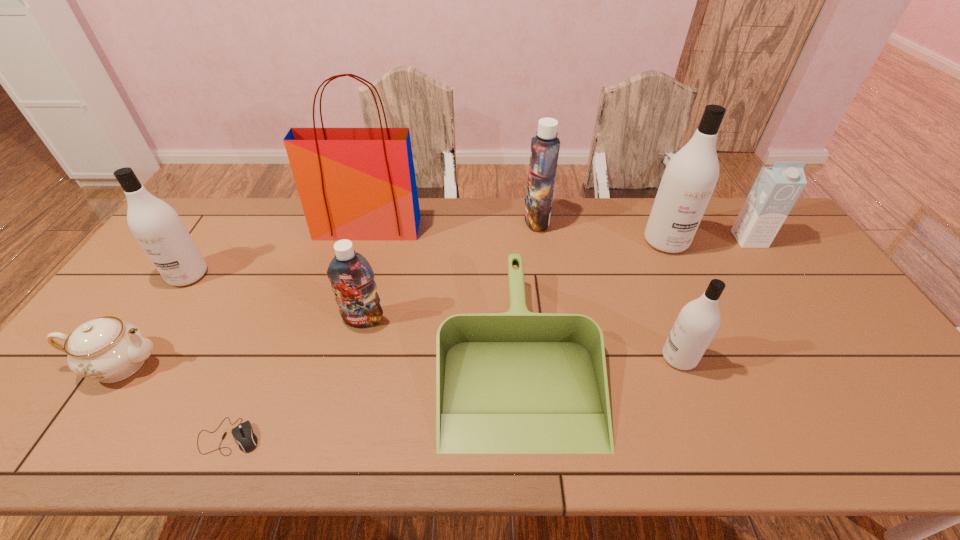
I want to click on the smaller blue shampoo, so click(x=352, y=279).

Identify the location of the fourth shampoo from right to left. The image size is (960, 540). (352, 279).

You are a GUI agent. You are given a task and a screenshot of the screen. Output one action in this format:
    pyautogui.click(x=<x>, y=<y>)
    Task: Click on the eighth tallest object
    This screenshot has height=540, width=960.
    Given the screenshot: What is the action you would take?
    pyautogui.click(x=107, y=349)

The image size is (960, 540). In order to click on dustpan in this screenshot , I will do `click(518, 382)`.

Image resolution: width=960 pixels, height=540 pixels. Find the location of `the shortest object`. the shortest object is located at coordinates (243, 433).

At what (x,y) coordinates should I click in order to perform the action: click on free space located on the handle side of the shopping bag. Please return your answer as a coordinate pair (x, y). The width and height of the screenshot is (960, 540). Looking at the image, I should click on (357, 267).

Locate an element on the screen. free space located 0.370m on the front-facing side of the tallest shampoo is located at coordinates (717, 353).

At what (x,y) coordinates should I click in order to perform the action: click on vacant space situated on the front label of the bigger blue shampoo. Please return your answer as a coordinate pair (x, y). The image size is (960, 540). Looking at the image, I should click on (432, 220).

Find the location of a particular element. The width and height of the screenshot is (960, 540). free space located on the front label of the bigger blue shampoo is located at coordinates (449, 220).

The width and height of the screenshot is (960, 540). In order to click on free space located on the front label of the bigger blue shampoo in this screenshot , I will do `click(510, 220)`.